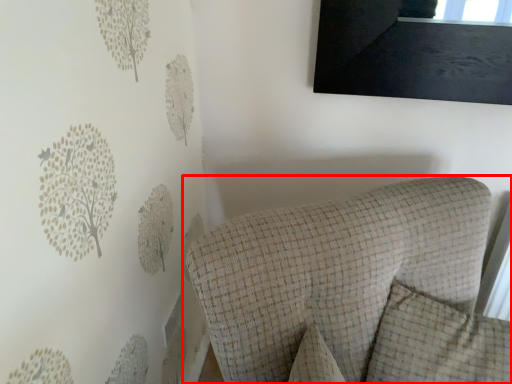
Question: From the image's perspective, what is the correct spatial positioning of furniture (annotated by the red box) in reference to pillow?

Choices:
 (A) below
 (B) above

Answer: (A)